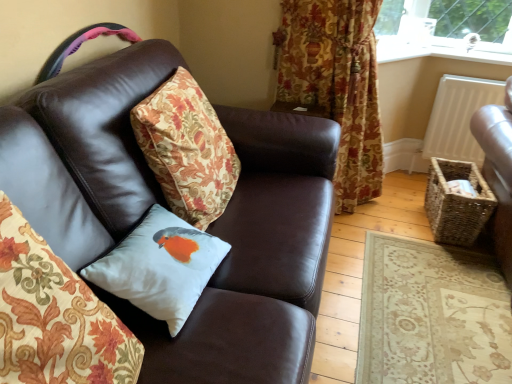
Question: In the image, is floral fabric curtain at upper right on the left side or the right side of white satin cushion at center, placed as the second pillow when sorted from back to front?

Choices:
 (A) right
 (B) left

Answer: (A)

Question: From the image's perspective, is floral fabric curtain at upper right located above or below white satin cushion at center, placed as the second pillow when sorted from back to front?

Choices:
 (A) below
 (B) above

Answer: (B)

Question: Estimate the real-world distances between objects in this image. Which object is farther from the white satin cushion with bird at center, placed as the 2th pillow when sorted from front to back?

Choices:
 (A) floral fabric curtain at upper right
 (B) brown leather couch at center
 (C) white matte radiator at upper right
 (D) white satin cushion at center, placed as the second pillow when sorted from back to front

Answer: (C)

Question: Which is farther from the white matte radiator at upper right?

Choices:
 (A) brown leather couch at center
 (B) white satin cushion at center, which is the 1th pillow in front-to-back order
 (C) floral fabric curtain at upper right
 (D) white satin cushion with bird at center, acting as the first pillow starting from the back

Answer: (B)